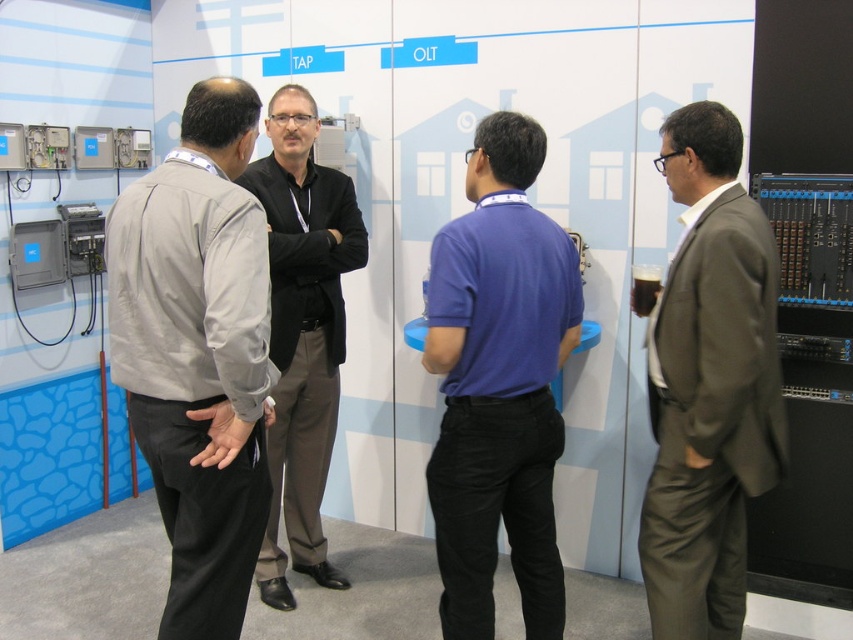
Question: Which of these objects is positioned farthest from the light gray fabric jacket at left?

Choices:
 (A) purple cotton polo shirt at center
 (B) black smooth shirt at center
 (C) matte brown suit at right

Answer: (C)

Question: Is matte brown suit at right bigger than black smooth shirt at center?

Choices:
 (A) yes
 (B) no

Answer: (B)

Question: Which point appears closest to the camera in this image?

Choices:
 (A) (281, 394)
 (B) (129, 365)
 (C) (439, 541)

Answer: (B)

Question: Which object appears closest to the camera in this image?

Choices:
 (A) matte brown suit at right
 (B) black smooth shirt at center

Answer: (A)

Question: Does purple cotton polo shirt at center have a greater width compared to black smooth shirt at center?

Choices:
 (A) yes
 (B) no

Answer: (A)

Question: Does purple cotton polo shirt at center have a lesser width compared to matte brown suit at right?

Choices:
 (A) yes
 (B) no

Answer: (B)